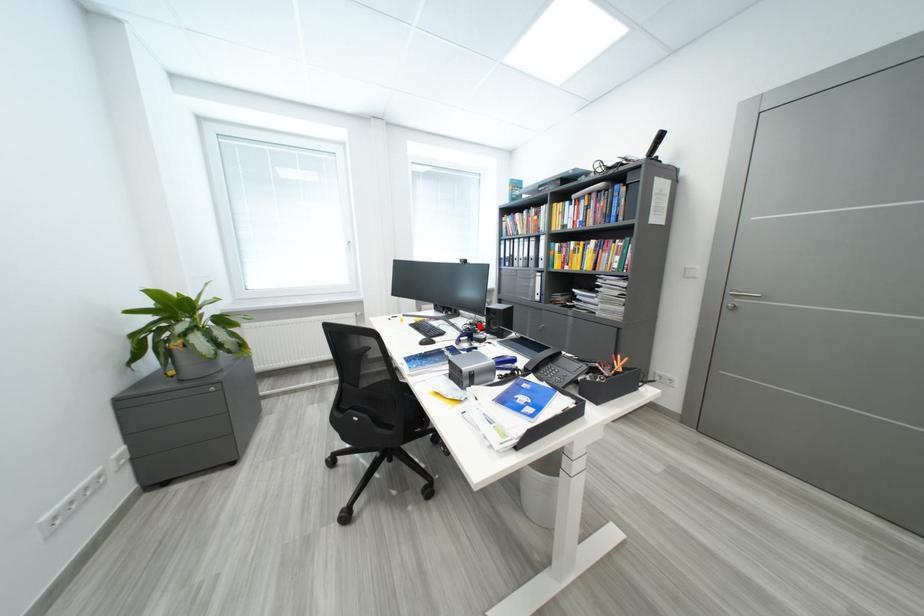
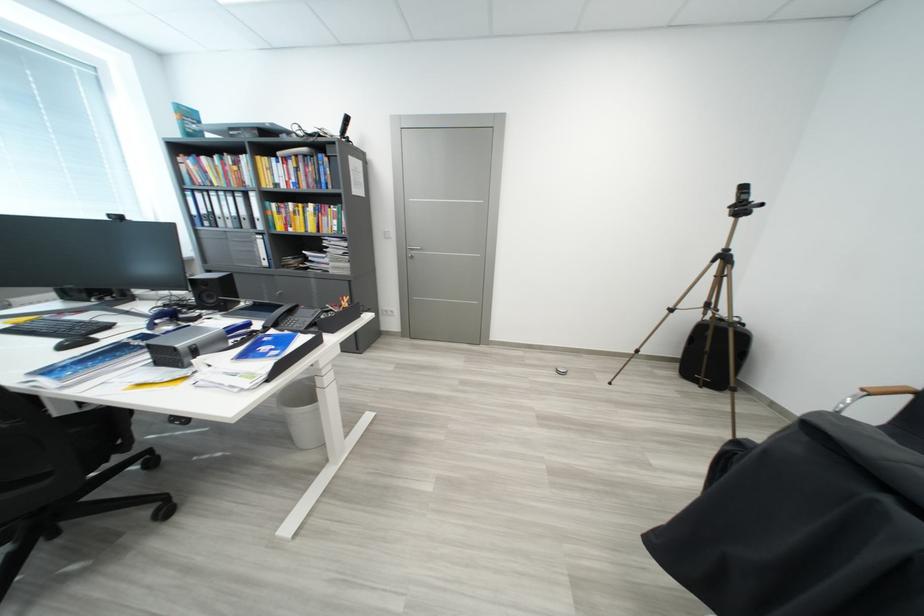
Find the pixel in the second image that matches the highlighted location in the first image.

(175, 308)